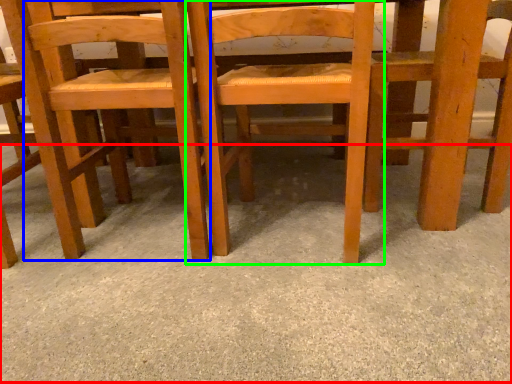
Question: Considering the real-world distances, which object is closest to concrete (highlighted by a red box)? chair (highlighted by a blue box) or chair (highlighted by a green box).

Choices:
 (A) chair
 (B) chair

Answer: (B)